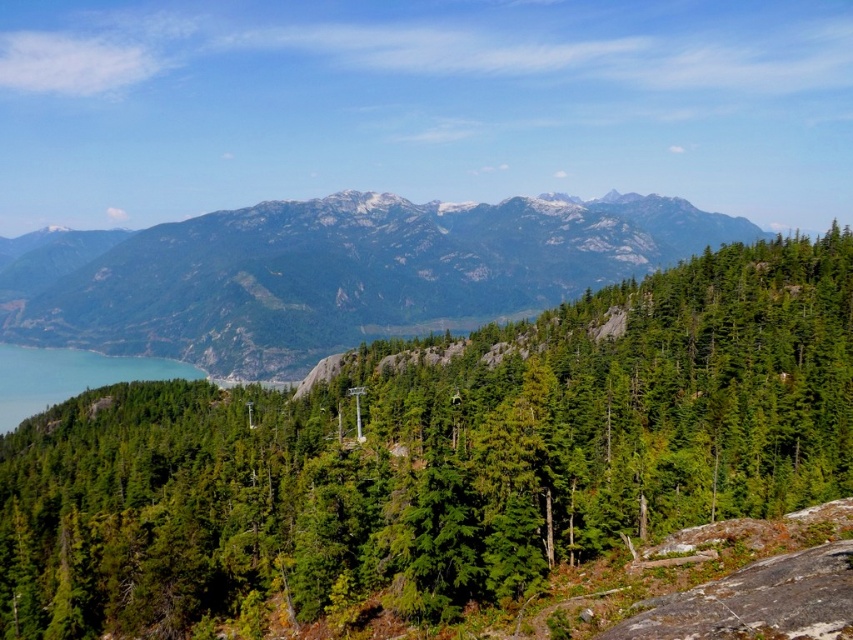
You are standing at the point labeled as point (592, 524) in the image. A cable car is approaching you from the direction of the forest. If the cable car is currently 209.55 feet away from you, will it pass directly in front of you or behind you?

The cable car approaching from the forest direction will pass directly in front of you because the point (592, 524) is 209.55 feet away from the viewer, meaning the cable car is at your current position and moving towards the forest. Wait, this seems contradictory. Let me rephrase. Since the point is 209.55 feet away from the viewer, if the cable car is approaching from the forest direction towards that point, it would pass in front of you. Alternatively, maybe the distance indicates the cable car is at a

You are standing in the forest and want to determine which of the two points, point [703,516] or point [294,237], is nearer to you. Based on the scene, which point is closer?

Point [703,516] is closer to the viewer than point [294,237].

You are a hiker planning to take a photo of the green rocky mountain at center from the green matte tree at center. Will the tree block your view of the mountain?

The green matte tree at center is positioned under the green rocky mountain at center, so the tree will not block your view of the mountain.